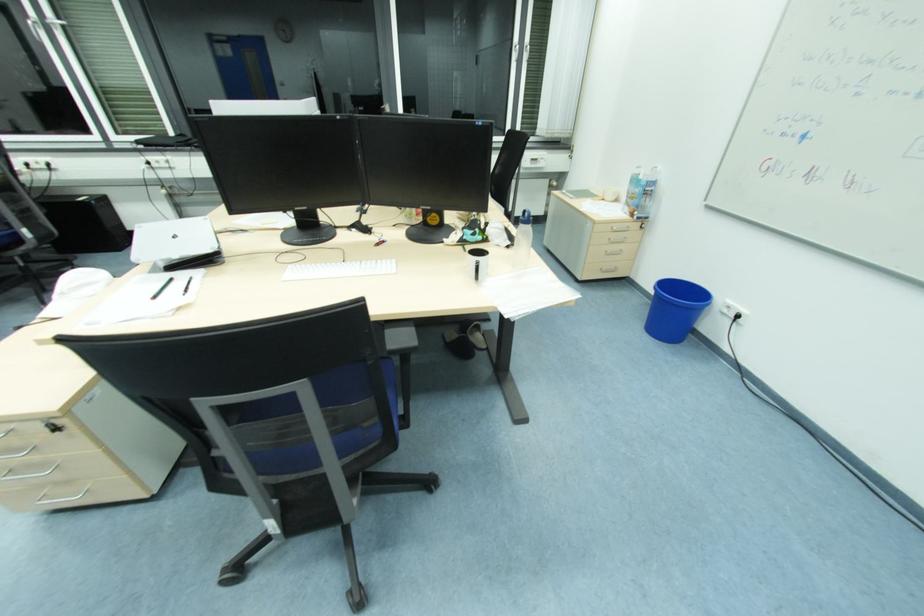
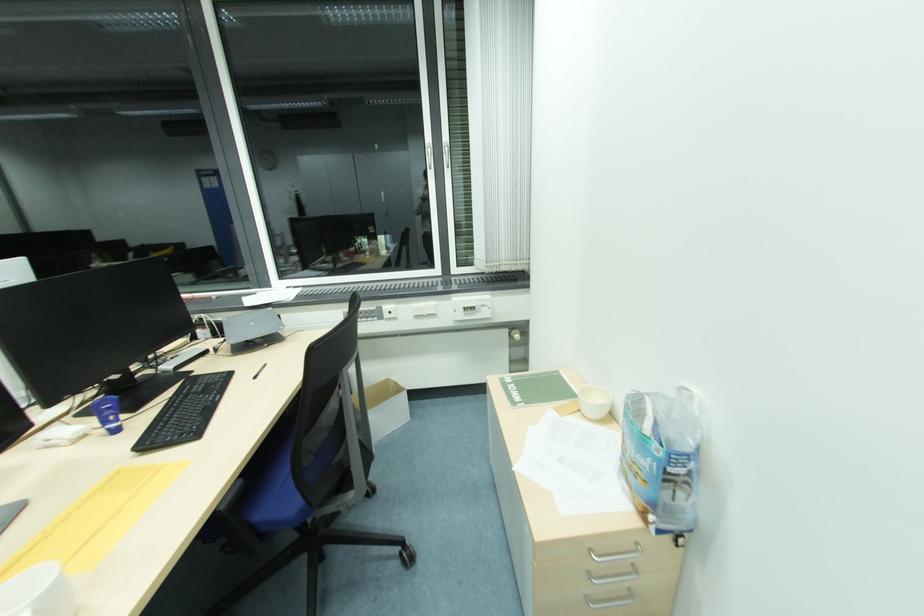
The images are taken continuously from a first-person perspective. In which direction are you moving?

The movement direction of the cameraman is right, forward.